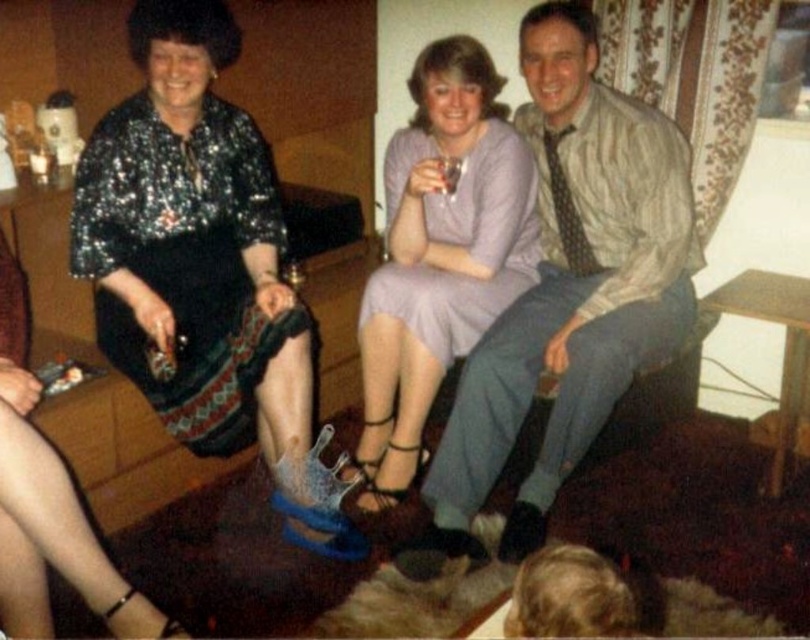
Can you confirm if shiny sequined dress at upper left is smaller than matte beige shirt at center?

No.

Who is more distant from viewer, (88, 241) or (563, 246)?

The point (563, 246) is more distant.

Identify the location of shiny sequined dress at upper left. This screenshot has height=640, width=810. (203, 268).

Consider the image. Between matte beige shirt at center and purple satin dress at center, which one has more height?

matte beige shirt at center is taller.

Locate an element on the screen. matte beige shirt at center is located at coordinates (567, 291).

The width and height of the screenshot is (810, 640). Describe the element at coordinates (203, 268) in the screenshot. I see `shiny sequined dress at upper left` at that location.

Where is `shiny sequined dress at upper left`? The height and width of the screenshot is (640, 810). shiny sequined dress at upper left is located at coordinates (203, 268).